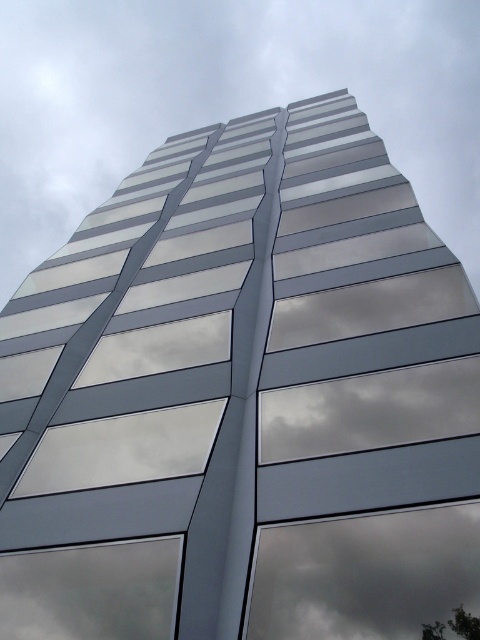
Does gray/metallic cloud at center have a lesser height compared to transparent glass window at lower left?

Incorrect, gray/metallic cloud at center's height does not fall short of transparent glass window at lower left's.

Does gray/metallic cloud at center come in front of transparent glass window at lower left?

No, it is behind transparent glass window at lower left.

The width and height of the screenshot is (480, 640). What do you see at coordinates (225, 99) in the screenshot? I see `gray/metallic cloud at center` at bounding box center [225, 99].

Find the location of a particular element. The height and width of the screenshot is (640, 480). gray/metallic cloud at center is located at coordinates point(225,99).

The height and width of the screenshot is (640, 480). Identify the location of gray/metallic cloud at center. (225, 99).

Between point (12, 189) and point (324, 621), which one is positioned in front?

Positioned in front is point (324, 621).

The width and height of the screenshot is (480, 640). In order to click on gray/metallic cloud at center in this screenshot , I will do `click(225, 99)`.

Between point (283, 576) and point (149, 545), which one is positioned in front?

Point (283, 576) is more forward.

Looking at this image, does dark gray reflective cloud at center appear on the right side of transparent glass window at lower left?

Correct, you'll find dark gray reflective cloud at center to the right of transparent glass window at lower left.

I want to click on dark gray reflective cloud at center, so click(x=370, y=576).